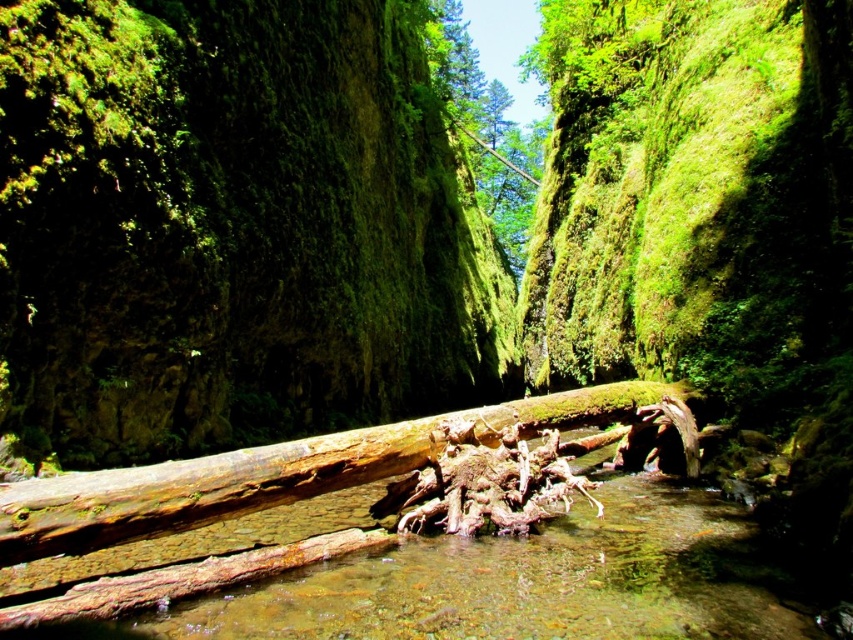
You are standing at the edge of the canyon and want to determine which of the two points, point (154, 476) or point (448, 3), is closer to you. Based on the scene description, which point is nearer?

Point (154, 476) is closer to the viewer than point (448, 3).